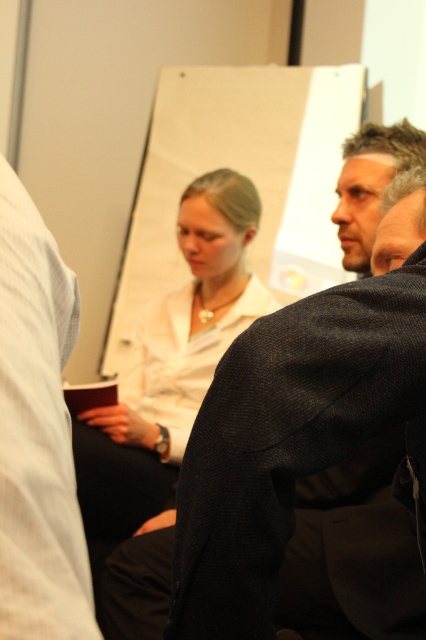
You are a photographer trying to capture a closeup shot of both the dark gray suit at center and the white matte shirt at center. Given that your camera can only focus on objects within a 5 feet range, will you be able to capture both in a single shot?

The dark gray suit at center and the white matte shirt at center are 4.52 feet apart from each other, so yes, the photographer can capture both in a single shot since the distance between them is within the camera focus range of 5 feet.

Based on the scene description, what are the coordinates of the white matte shirt at center?

The white matte shirt at center is located at coordinates point (170, 365).